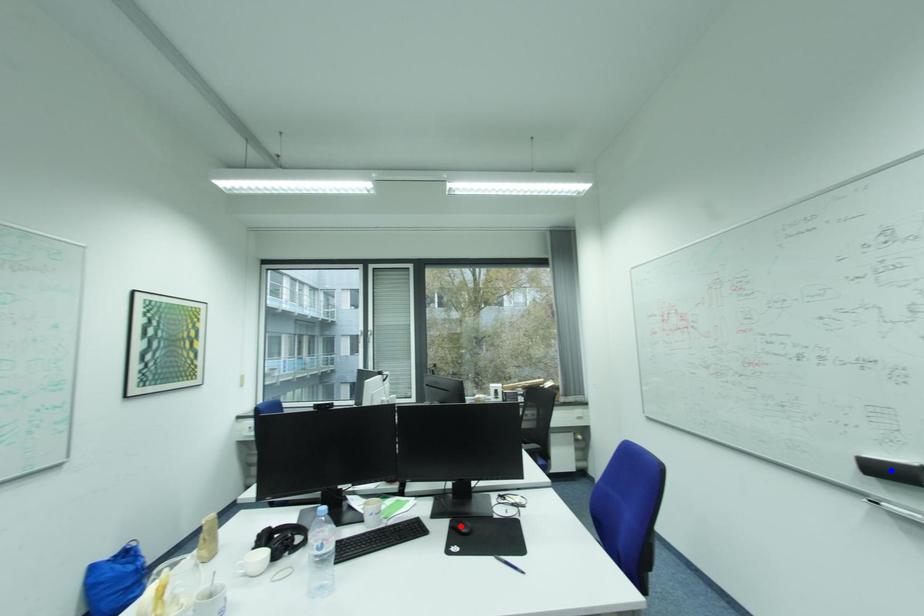
Question: Which of the two points in the image is closer to the camera?

Choices:
 (A) Blue point is closer.
 (B) Red point is closer.

Answer: (A)